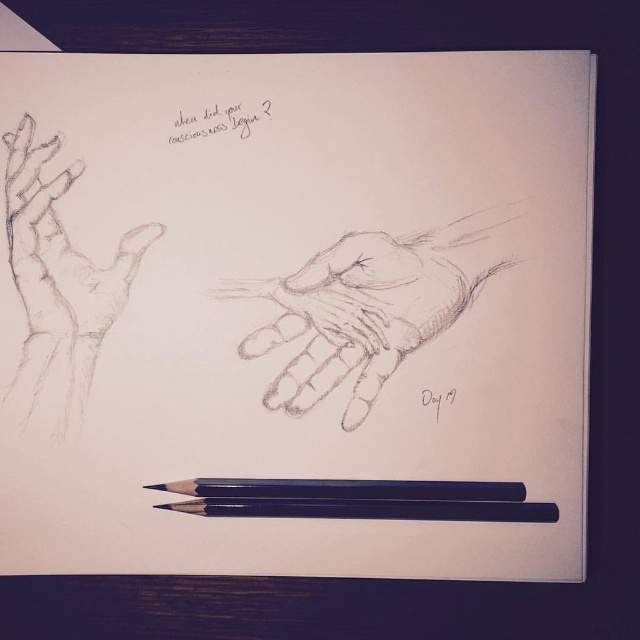
Question: Is graphite sketch hand at upper left to the right of black smooth pencil at bottom from the viewer's perspective?

Choices:
 (A) yes
 (B) no

Answer: (B)

Question: Among these objects, which one is farthest from the camera?

Choices:
 (A) black smooth pencil at bottom
 (B) graphite sketch hand at upper left

Answer: (B)

Question: Is graphite sketch hand at upper left thinner than black smooth pencil at bottom?

Choices:
 (A) yes
 (B) no

Answer: (A)

Question: Which point is closer to the camera?

Choices:
 (A) (32, 305)
 (B) (356, 496)

Answer: (B)

Question: Is graphite sketch hand at upper left thinner than black smooth pencil at bottom?

Choices:
 (A) no
 (B) yes

Answer: (B)